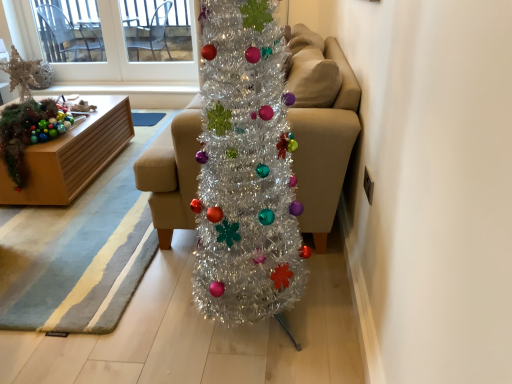
Question: In terms of width, does white plastic window screen at upper left look wider or thinner when compared to shiny metallic garland at left?

Choices:
 (A) wide
 (B) thin

Answer: (B)

Question: Does point coord(187,61) appear closer or farther from the camera than point coord(10,175)?

Choices:
 (A) farther
 (B) closer

Answer: (A)

Question: Estimate the real-world distances between objects in this image. Which object is closer to the beige fabric couch at center?

Choices:
 (A) shiny metallic garland at left
 (B) white plastic window screen at upper left
 (C) wooden box at left

Answer: (C)

Question: Which object is the closest to the wooden box at left?

Choices:
 (A) beige fabric couch at center
 (B) white plastic window screen at upper left
 (C) shiny metallic garland at left

Answer: (C)